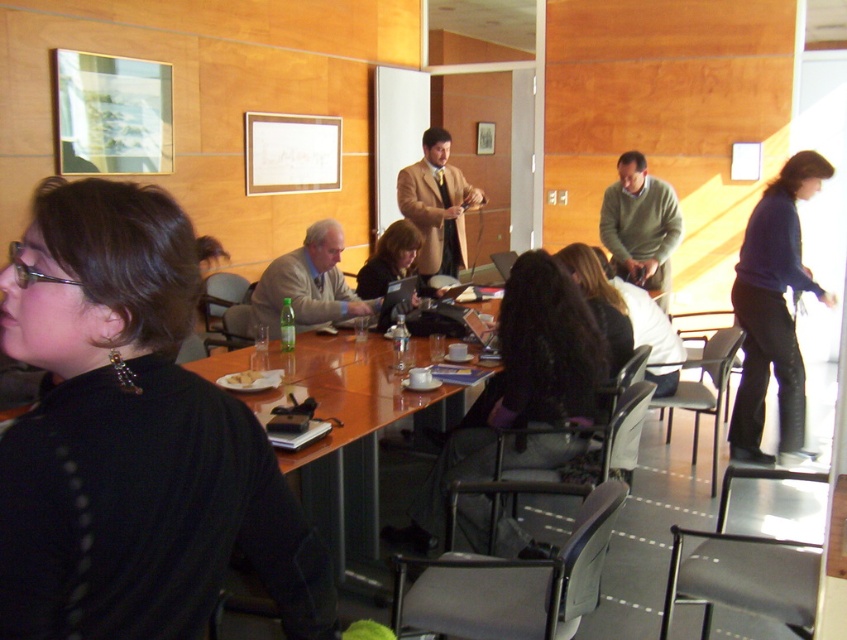
Does black matte sweater at left have a smaller size compared to wooden table at center?

Indeed, black matte sweater at left has a smaller size compared to wooden table at center.

Which of these two, black matte sweater at left or wooden table at center, stands taller?

wooden table at center is taller.

Find the location of `black matte sweater at left`. black matte sweater at left is located at coordinates (131, 438).

Can you confirm if wooden table at center is positioned below white crumbly bread at table center?

Yes.

Does point (318, 512) come closer to viewer compared to point (234, 384)?

No, (318, 512) is further to viewer.

This screenshot has height=640, width=847. Describe the element at coordinates (349, 435) in the screenshot. I see `wooden table at center` at that location.

Where is `wooden table at center`? The width and height of the screenshot is (847, 640). wooden table at center is located at coordinates (349, 435).

Between black fabric jacket at center and dark blue sweater at right, which one appears on the right side from the viewer's perspective?

Positioned to the right is dark blue sweater at right.

I want to click on black fabric jacket at center, so click(518, 387).